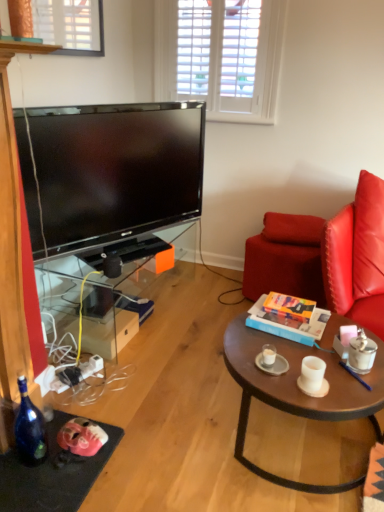
What are the coordinates of `free region on the left part of white matte coffee cup at center, the third coffee cup positioned from the right` in the screenshot? It's located at (244, 358).